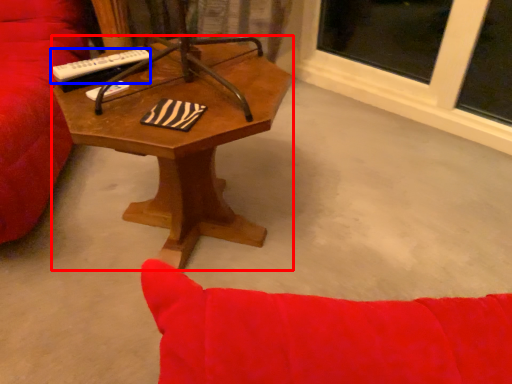
Question: Which object is closer to the camera taking this photo, coffee table (highlighted by a red box) or remote control (highlighted by a blue box)?

Choices:
 (A) coffee table
 (B) remote control

Answer: (A)